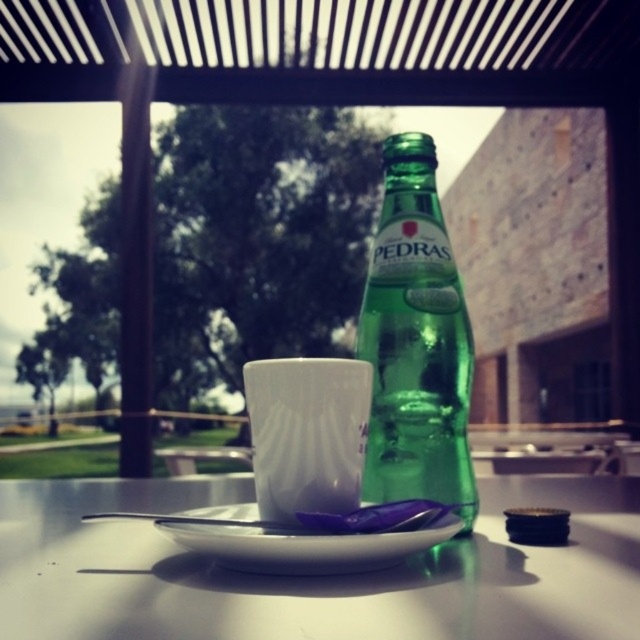
You are a customer at this outdoor table and want to place your phone between the two points, point [173,483] and point [278,456]. Since you want your phone to be closer to you, which point should you position it near?

To place your phone closer to yourself, position it near point [173,483] because it is closer to the viewer compared to point [278,456].

You are setting up a tea service and need to place a teapot on the table. The teapot has a diameter of 15 cm. The white glossy plate at center and the white glossy saucer at center are both available. Which object can accommodate the teapot based on their sizes?

The white glossy plate at center is larger in size than the white glossy saucer at center, so the teapot with a diameter of 15 cm can be placed on the white glossy plate at center.